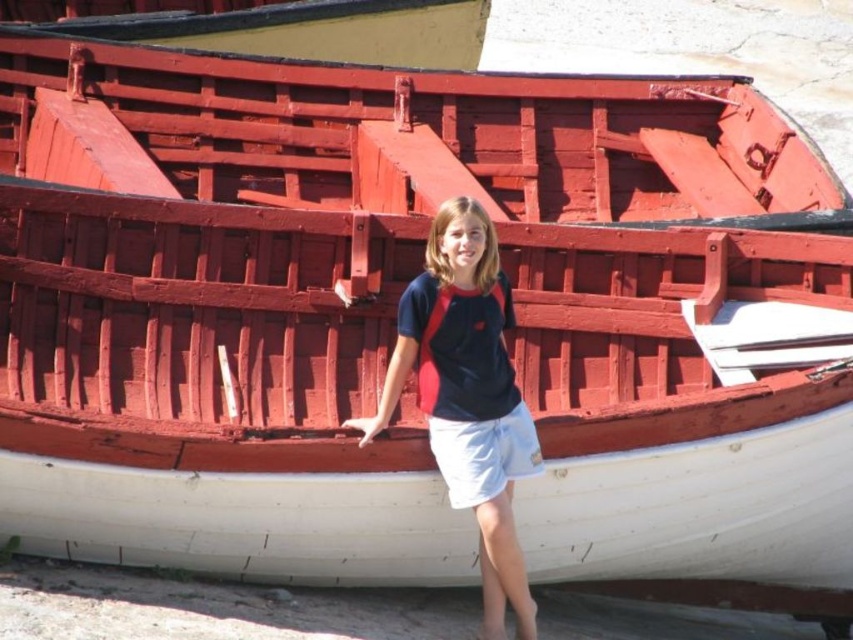
Question: Does matte black shirt at center have a larger size compared to smooth yellow wood boat at upper center?

Choices:
 (A) yes
 (B) no

Answer: (B)

Question: Can you confirm if matte black shirt at center is wider than smooth yellow wood boat at upper center?

Choices:
 (A) yes
 (B) no

Answer: (B)

Question: Which object appears farthest from the camera in this image?

Choices:
 (A) smooth yellow wood boat at upper center
 (B) matte black shirt at center

Answer: (A)

Question: Can you confirm if matte black shirt at center is positioned below smooth yellow wood boat at upper center?

Choices:
 (A) yes
 (B) no

Answer: (A)

Question: Which of the following is the farthest from the observer?

Choices:
 (A) smooth yellow wood boat at upper center
 (B) matte black shirt at center

Answer: (A)

Question: Which point is farther to the camera?

Choices:
 (A) matte black shirt at center
 (B) smooth yellow wood boat at upper center

Answer: (B)